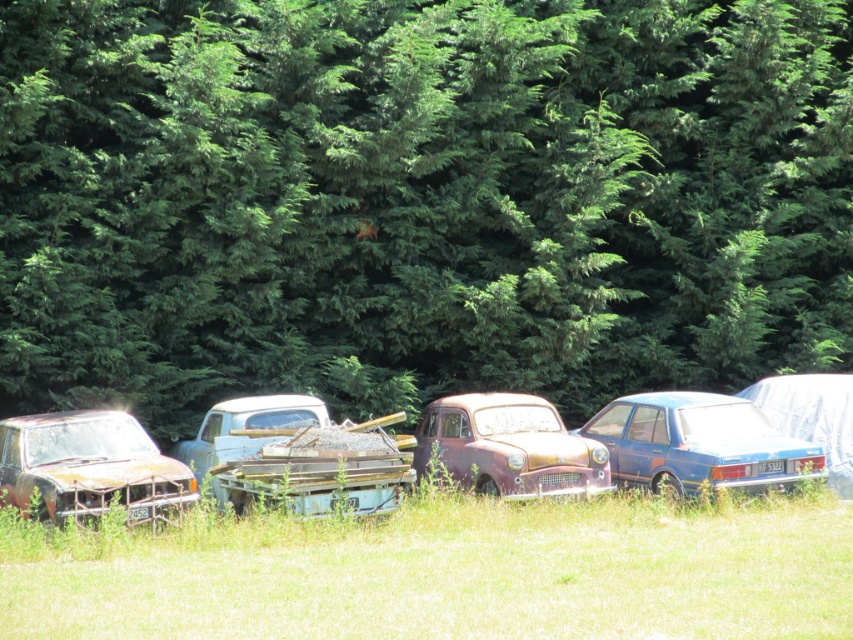
You are a photographer trying to capture both the rusty metal car at left and the rusty metal car at center in a single frame. Since you want the cars to appear proportionally accurate, which car should you position closer to the camera to maintain their actual size relationship?

The rusty metal car at left is shorter than the rusty metal car at center. To maintain their actual size relationship, you should position the rusty metal car at left closer to the camera so it appears larger in the frame, matching the size of the rusty metal car at center which is farther away.

You are a gardener looking to plant a new shrub between the green leafy tree at upper center and the green grass at lower center. Considering their sizes, which area would provide more space for the shrub to grow?

The green leafy tree at upper center has a larger width than the green grass at lower center, so planting the shrub near the green leafy tree at upper center would provide more space for growth.